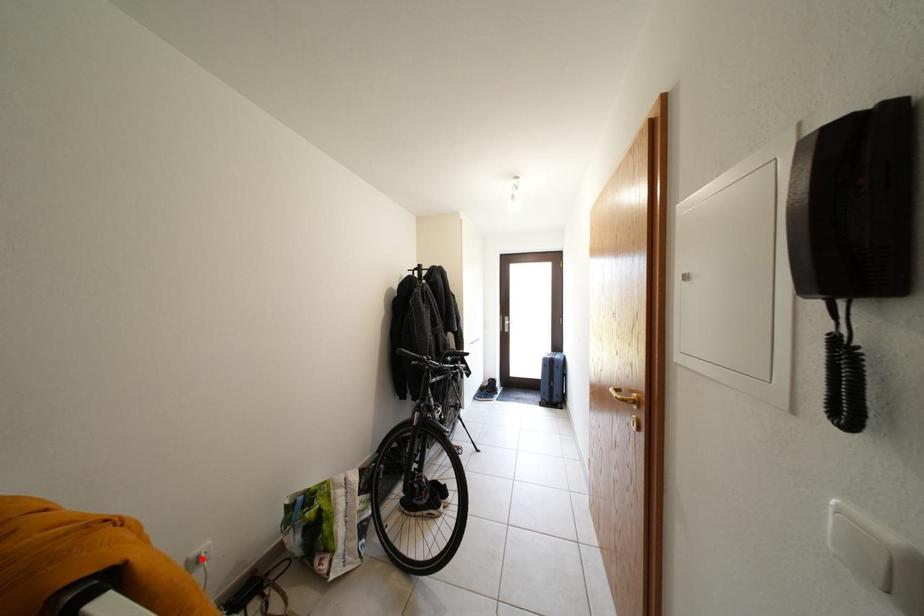
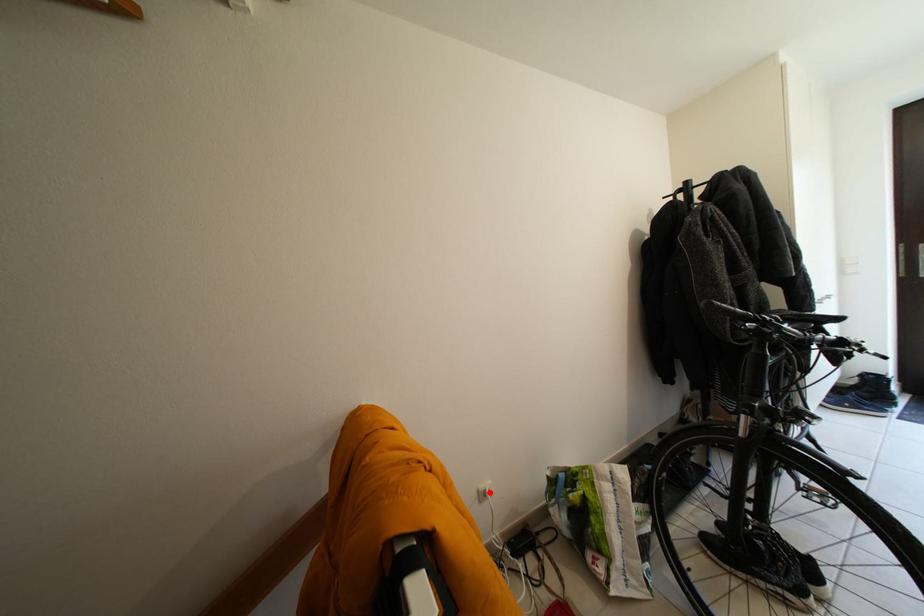
I am providing you with two images of the same scene from different viewpoints. A red point is marked on the first image and another point is marked on the second image. Do the highlighted points in image1 and image2 indicate the same real-world spot?

Yes